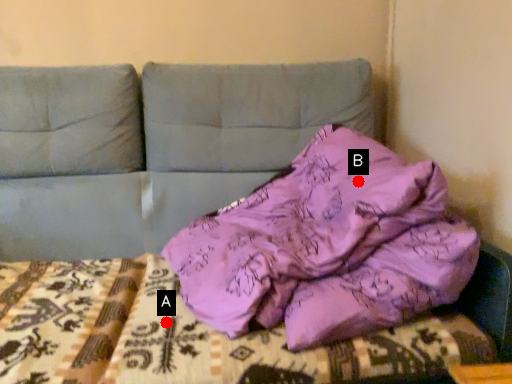
Question: Two points are circled on the image, labeled by A and B beside each circle. Which point is farther to the camera?

Choices:
 (A) A is further
 (B) B is further

Answer: (B)